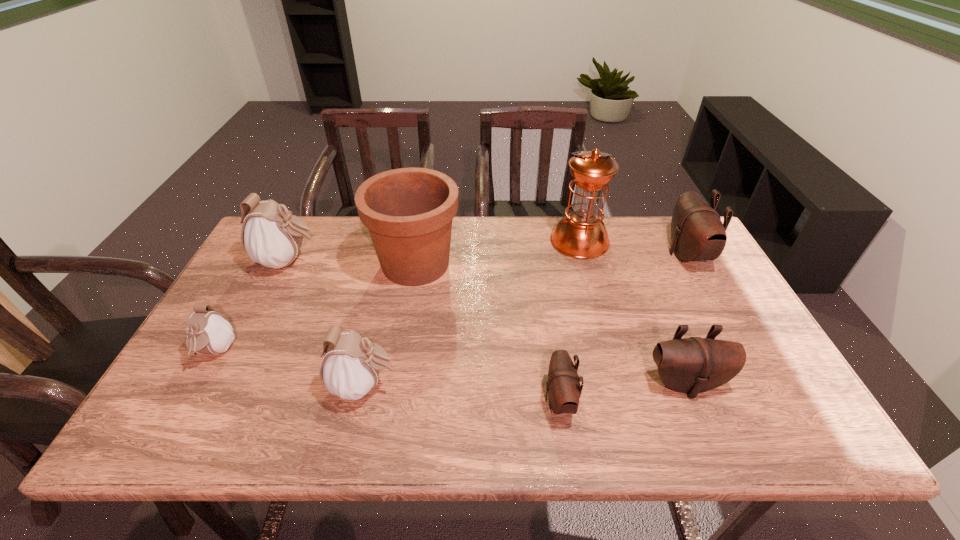
Select which object appears as the closest to the second biggest brown pouch. Please provide its 2D coordinates. Your answer should be formatted as a tuple, i.e. [(x, y)], where the tuple contains the x and y coordinates of a point satisfying the conditions above.

[(563, 387)]

At what (x,y) coordinates should I click in order to perform the action: click on the fifth closest object relative to the flowerpot. Please return your answer as a coordinate pair (x, y). Looking at the image, I should click on (563, 387).

Point out which pouch is positioned as the fourth nearest to the tallest object. Please provide its 2D coordinates. Your answer should be formatted as a tuple, i.e. [(x, y)], where the tuple contains the x and y coordinates of a point satisfying the conditions above.

[(350, 368)]

The height and width of the screenshot is (540, 960). In order to click on pouch that stands as the fourth closest to the smallest white pouch in this screenshot , I will do `click(693, 365)`.

Identify which white pouch is located as the nearest to the fourth pouch from right to left. Please provide its 2D coordinates. Your answer should be formatted as a tuple, i.e. [(x, y)], where the tuple contains the x and y coordinates of a point satisfying the conditions above.

[(208, 332)]

Where is `white pouch identified as the second closest to the rightmost brown pouch`? The image size is (960, 540). white pouch identified as the second closest to the rightmost brown pouch is located at coordinates (272, 237).

Select which brown pouch is the second closest to the second pouch from right to left. Please provide its 2D coordinates. Your answer should be formatted as a tuple, i.e. [(x, y)], where the tuple contains the x and y coordinates of a point satisfying the conditions above.

[(697, 232)]

Identify which brown pouch is located as the second nearest to the flowerpot. Please provide its 2D coordinates. Your answer should be formatted as a tuple, i.e. [(x, y)], where the tuple contains the x and y coordinates of a point satisfying the conditions above.

[(693, 365)]

Where is `free space in the image that satisfies the following two spatial constraints: 1. on the front-facing side of the flowerpot; 2. on the left side of the farthest white pouch`? The width and height of the screenshot is (960, 540). free space in the image that satisfies the following two spatial constraints: 1. on the front-facing side of the flowerpot; 2. on the left side of the farthest white pouch is located at coordinates (288, 264).

In order to click on vacant region that satisfies the following two spatial constraints: 1. with the flap open on the farthest brown pouch; 2. with the flap open on the second smallest brown pouch in this screenshot , I will do `click(757, 383)`.